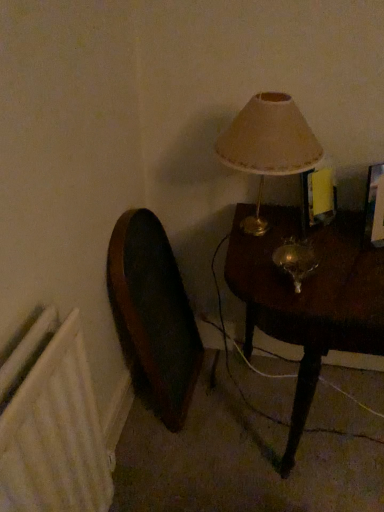
This screenshot has height=512, width=384. In order to click on free space in front of matte beige lampshade at upper right in this screenshot , I will do `click(293, 294)`.